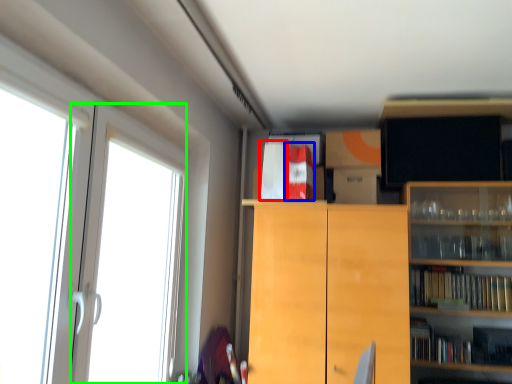
Question: Estimate the real-world distances between objects in this image. Which object is closer to book (highlighted by a red box), book (highlighted by a blue box) or screen door (highlighted by a green box)?

Choices:
 (A) book
 (B) screen door

Answer: (A)